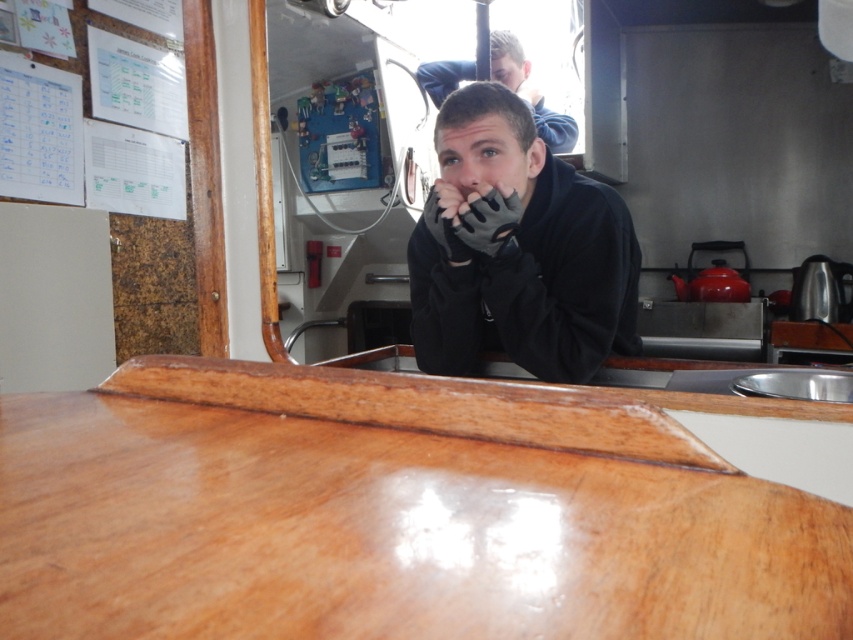
Can you confirm if glossy wood counter at center is positioned to the right of matte black glove at center?

Incorrect, glossy wood counter at center is not on the right side of matte black glove at center.

Does point (422, 579) come in front of point (514, 216)?

Yes, it is in front of point (514, 216).

The width and height of the screenshot is (853, 640). I want to click on glossy wood counter at center, so click(x=386, y=532).

Can you confirm if matte black glove at center is positioned below matte black nose at center?

Indeed, matte black glove at center is positioned under matte black nose at center.

Is matte black glove at center bigger than matte black nose at center?

Yes.

Does point (476, 208) lie behind point (469, 163)?

That is False.

Find the location of a particular element. The image size is (853, 640). matte black glove at center is located at coordinates (488, 221).

Which is above, matte black jacket at upper center or matte black nose at center?

matte black jacket at upper center is above.

What are the coordinates of `matte black jacket at upper center` in the screenshot? It's located at (529, 90).

Where is `matte black jacket at upper center`? This screenshot has width=853, height=640. matte black jacket at upper center is located at coordinates (529, 90).